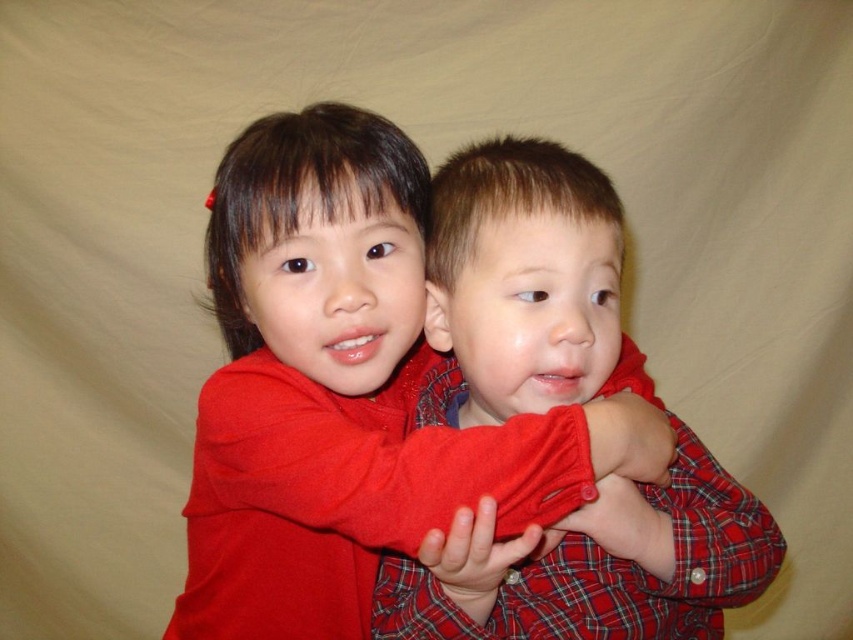
You are a photographer setting up for a portrait. You want to ensure that both the matte red sweater at center and the plaid fabric shirt at center are clearly visible in the photo. Given their positions, which one might you need to adjust to avoid being obscured?

The plaid fabric shirt at center is behind the matte red sweater at center, so you might need to adjust the plaid fabric shirt at center to move it forward to avoid being obscured.

You are a photographer trying to capture a closeup of the matte red sweater at center and the plaid fabric shirt at center. The camera lens has a maximum focus range of 10 centimeters. Can you focus on both items simultaneously?

The matte red sweater at center is 10.98 centimeters away from the plaid fabric shirt at center. Since the distance between them exceeds the camera lens maximum focus range of 10 centimeters, you cannot focus on both items simultaneously.